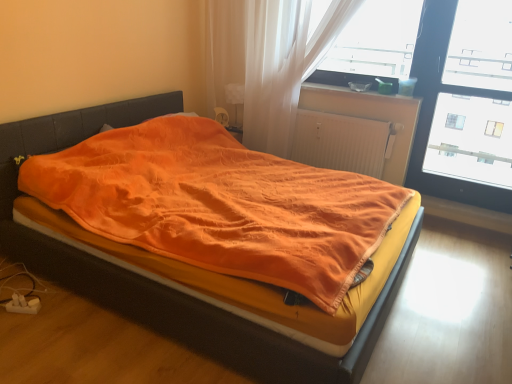
What is the approximate width of matte plastic container at upper right?

matte plastic container at upper right is 7.60 inches wide.

This screenshot has height=384, width=512. What do you see at coordinates (268, 60) in the screenshot?
I see `translucent fabric curtain at upper center` at bounding box center [268, 60].

Locate an element on the screen. Image resolution: width=512 pixels, height=384 pixels. matte plastic container at upper right is located at coordinates (356, 92).

Who is taller, orange satin bed at center or translucent fabric curtain at upper center?

translucent fabric curtain at upper center.

What's the angular difference between orange satin bed at center and translucent fabric curtain at upper center's facing directions?

They differ by 90 degrees in their facing directions.

Considering the relative sizes of orange satin bed at center and translucent fabric curtain at upper center in the image provided, is orange satin bed at center smaller than translucent fabric curtain at upper center?

No.

From the image's perspective, is orange satin bed at center below translucent fabric curtain at upper center?

Yes, from the image's perspective, orange satin bed at center is below translucent fabric curtain at upper center.

Is matte plastic container at upper right completely or partially inside white ribbed radiator at center?

No.

Is white ribbed radiator at center bigger than matte plastic container at upper right?

Yes.

Is white ribbed radiator at center oriented towards matte plastic container at upper right?

No, white ribbed radiator at center is not oriented towards matte plastic container at upper right.

Which of these two, white ribbed radiator at center or translucent fabric curtain at upper center, stands taller?

With more height is translucent fabric curtain at upper center.

Which object is more forward, white ribbed radiator at center or translucent fabric curtain at upper center?

translucent fabric curtain at upper center is in front.

From a real-world perspective, which is physically below, white ribbed radiator at center or translucent fabric curtain at upper center?

white ribbed radiator at center is physically lower.

Is point (343, 144) positioned in front of point (272, 75)?

No, it is not.

From a real-world perspective, is transparent plastic window screen at upper right, which ranks as the 2th window screen in right-to-left order, physically below transparent glass window at upper right, which is counted as the second window screen, starting from the left?

Incorrect, from a real-world perspective, transparent plastic window screen at upper right, which ranks as the 2th window screen in right-to-left order, is higher than transparent glass window at upper right, which is counted as the second window screen, starting from the left.

Who is taller, transparent plastic window screen at upper right, which ranks as the 2th window screen in right-to-left order, or transparent glass window at upper right, the first window screen when ordered from right to left?

transparent glass window at upper right, the first window screen when ordered from right to left, is taller.

Considering the relative sizes of transparent plastic window screen at upper right, which ranks as the 2th window screen in right-to-left order, and transparent glass window at upper right, which is counted as the second window screen, starting from the left, in the image provided, is transparent plastic window screen at upper right, which ranks as the 2th window screen in right-to-left order, smaller than transparent glass window at upper right, which is counted as the second window screen, starting from the left,?

Indeed, transparent plastic window screen at upper right, which ranks as the 2th window screen in right-to-left order, has a smaller size compared to transparent glass window at upper right, which is counted as the second window screen, starting from the left.

Considering the sizes of transparent plastic window screen at upper right, which is the 1th window screen in left-to-right order, and transparent glass window at upper right, which is counted as the second window screen, starting from the left, in the image, is transparent plastic window screen at upper right, which is the 1th window screen in left-to-right order, wider or thinner than transparent glass window at upper right, which is counted as the second window screen, starting from the left,?

Clearly, transparent plastic window screen at upper right, which is the 1th window screen in left-to-right order, has less width compared to transparent glass window at upper right, which is counted as the second window screen, starting from the left.

Which is correct: transparent glass window at upper right, the first window screen when ordered from right to left, is inside orange satin bed at center, or outside of it?

transparent glass window at upper right, the first window screen when ordered from right to left, is not enclosed by orange satin bed at center.

Is transparent glass window at upper right, the first window screen when ordered from right to left, taller than orange satin bed at center?

Yes, transparent glass window at upper right, the first window screen when ordered from right to left, is taller than orange satin bed at center.

At what (x,y) coordinates should I click in order to perform the action: click on bed lying below the transparent glass window at upper right, the first window screen when ordered from right to left (from the image's perspective). Please return your answer as a coordinate pair (x, y). The height and width of the screenshot is (384, 512). Looking at the image, I should click on (156, 282).

Considering the sizes of objects orange satin bed at center and transparent plastic window screen at upper right, which ranks as the 2th window screen in right-to-left order, in the image provided, who is taller, orange satin bed at center or transparent plastic window screen at upper right, which ranks as the 2th window screen in right-to-left order,?

orange satin bed at center.

How different are the orientations of orange satin bed at center and transparent plastic window screen at upper right, which ranks as the 2th window screen in right-to-left order, in degrees?

orange satin bed at center and transparent plastic window screen at upper right, which ranks as the 2th window screen in right-to-left order, are facing 90 degrees away from each other.

From a real-world perspective, who is located lower, orange satin bed at center or transparent plastic window screen at upper right, which ranks as the 2th window screen in right-to-left order?

In real-world perspective, orange satin bed at center is lower.

Based on the photo, does orange satin bed at center have a smaller size compared to transparent plastic window screen at upper right, which ranks as the 2th window screen in right-to-left order?

No, orange satin bed at center is not smaller than transparent plastic window screen at upper right, which ranks as the 2th window screen in right-to-left order.

Is orange satin bed at center aimed at transparent glass window at upper right, the first window screen when ordered from right to left?

No, orange satin bed at center is not aimed at transparent glass window at upper right, the first window screen when ordered from right to left.

Is point (40, 135) closer or farther from the camera than point (485, 31)?

Point (40, 135) appears to be closer to the viewer than point (485, 31).

From the image's perspective, is orange satin bed at center under transparent glass window at upper right, which is counted as the second window screen, starting from the left?

Yes, from the image's perspective, orange satin bed at center is beneath transparent glass window at upper right, which is counted as the second window screen, starting from the left.

Can you confirm if orange satin bed at center is thinner than transparent glass window at upper right, which is counted as the second window screen, starting from the left?

Incorrect, the width of orange satin bed at center is not less than that of transparent glass window at upper right, which is counted as the second window screen, starting from the left.

Find the location of a particular element. The image size is (512, 384). bed below the translucent fabric curtain at upper center (from a real-world perspective) is located at coordinates (156, 282).

Where is `window sill above the white ribbed radiator at center (from a real-world perspective)`? This screenshot has width=512, height=384. window sill above the white ribbed radiator at center (from a real-world perspective) is located at coordinates (356, 92).

From the image, which object appears to be nearer to matte plastic container at upper right, translucent fabric curtain at upper center or white ribbed radiator at center?

Based on the image, white ribbed radiator at center appears to be nearer to matte plastic container at upper right.

Based on their spatial positions, is matte plastic container at upper right or orange satin bed at center further from white ribbed radiator at center?

orange satin bed at center.

Which object lies nearer to the anchor point translucent fabric curtain at upper center, transparent plastic window screen at upper right, which ranks as the 2th window screen in right-to-left order, or transparent glass window at upper right, the first window screen when ordered from right to left?

The object closer to translucent fabric curtain at upper center is transparent plastic window screen at upper right, which ranks as the 2th window screen in right-to-left order.

Estimate the real-world distances between objects in this image. Which object is closer to orange satin bed at center, white ribbed radiator at center or transparent plastic window screen at upper right, which ranks as the 2th window screen in right-to-left order?

Based on the image, white ribbed radiator at center appears to be nearer to orange satin bed at center.

Looking at the image, which one is located further to orange satin bed at center, translucent fabric curtain at upper center or transparent plastic window screen at upper right, which is the 1th window screen in left-to-right order?

transparent plastic window screen at upper right, which is the 1th window screen in left-to-right order, is further to orange satin bed at center.

Which object lies nearer to the anchor point transparent plastic window screen at upper right, which is the 1th window screen in left-to-right order, matte plastic container at upper right or white ribbed radiator at center?

matte plastic container at upper right lies closer to transparent plastic window screen at upper right, which is the 1th window screen in left-to-right order, than the other object.

Looking at the image, which one is located further to orange satin bed at center, transparent glass window at upper right, which is counted as the second window screen, starting from the left, or transparent plastic window screen at upper right, which is the 1th window screen in left-to-right order?

transparent glass window at upper right, which is counted as the second window screen, starting from the left, is further to orange satin bed at center.

Considering their positions, is white ribbed radiator at center positioned closer to transparent plastic window screen at upper right, which is the 1th window screen in left-to-right order, than orange satin bed at center?

The object closer to transparent plastic window screen at upper right, which is the 1th window screen in left-to-right order, is white ribbed radiator at center.

Identify the location of curtain between orange satin bed at center and white ribbed radiator at center in the front-back direction. The width and height of the screenshot is (512, 384). (268, 60).

I want to click on curtain between transparent plastic window screen at upper right, which is the 1th window screen in left-to-right order, and white ribbed radiator at center, in the vertical direction, so click(268, 60).

At what (x,y) coordinates should I click in order to perform the action: click on window screen between matte plastic container at upper right and transparent glass window at upper right, which is counted as the second window screen, starting from the left, in the horizontal direction. Please return your answer as a coordinate pair (x, y). This screenshot has height=384, width=512. Looking at the image, I should click on (377, 40).

Find the location of a particular element. The image size is (512, 384). curtain between orange satin bed at center and transparent glass window at upper right, which is counted as the second window screen, starting from the left, in the horizontal direction is located at coordinates (268, 60).